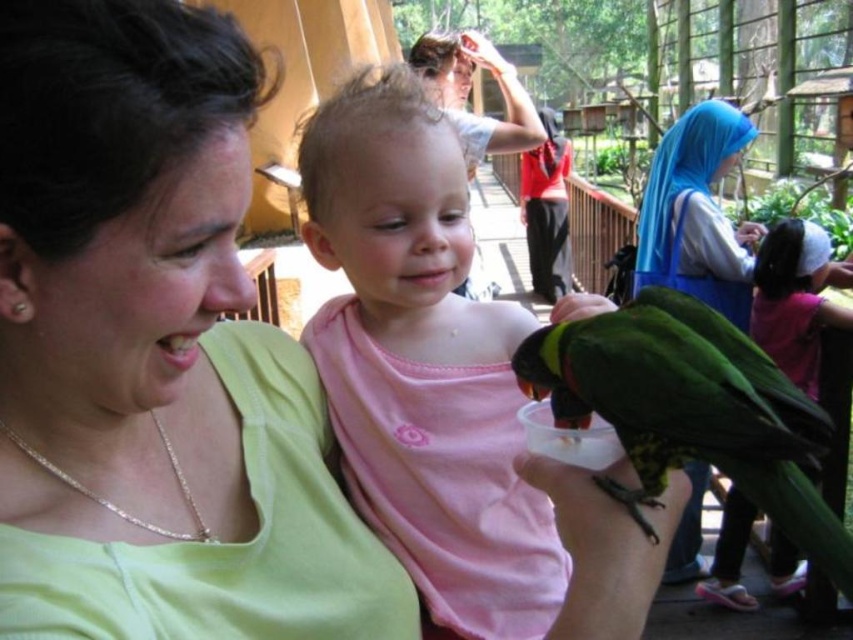
Question: Does matte green shirt at upper left lie behind blue silk hijab at upper right?

Choices:
 (A) no
 (B) yes

Answer: (A)

Question: Which object appears farthest from the camera in this image?

Choices:
 (A) pink matte shirt at center
 (B) matte green shirt at upper left
 (C) green matte parrot at lower right

Answer: (A)

Question: Does matte green shirt at upper left have a lesser width compared to pink matte shirt at center?

Choices:
 (A) no
 (B) yes

Answer: (B)

Question: From the image, what is the correct spatial relationship of matte green shirt at upper left in relation to pink matte shirt at center?

Choices:
 (A) above
 (B) below

Answer: (B)

Question: Which object is positioned closest to the green matte parrot at lower right?

Choices:
 (A) pink matte shirt at center
 (B) matte green shirt at upper left

Answer: (B)

Question: Which is nearer to the blue silk hijab at upper right?

Choices:
 (A) green matte parrot at lower right
 (B) pink matte shirt at center
 (C) matte green shirt at upper left

Answer: (B)